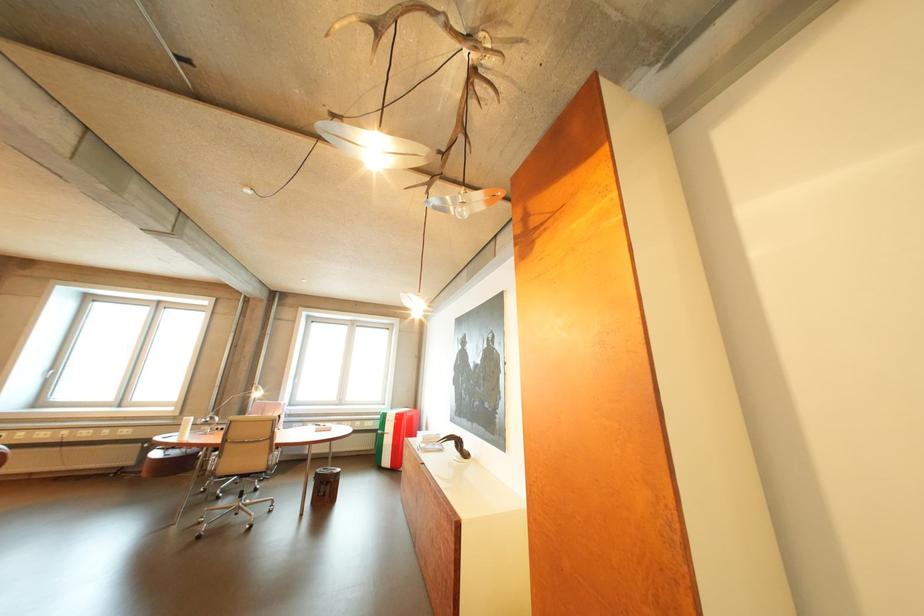
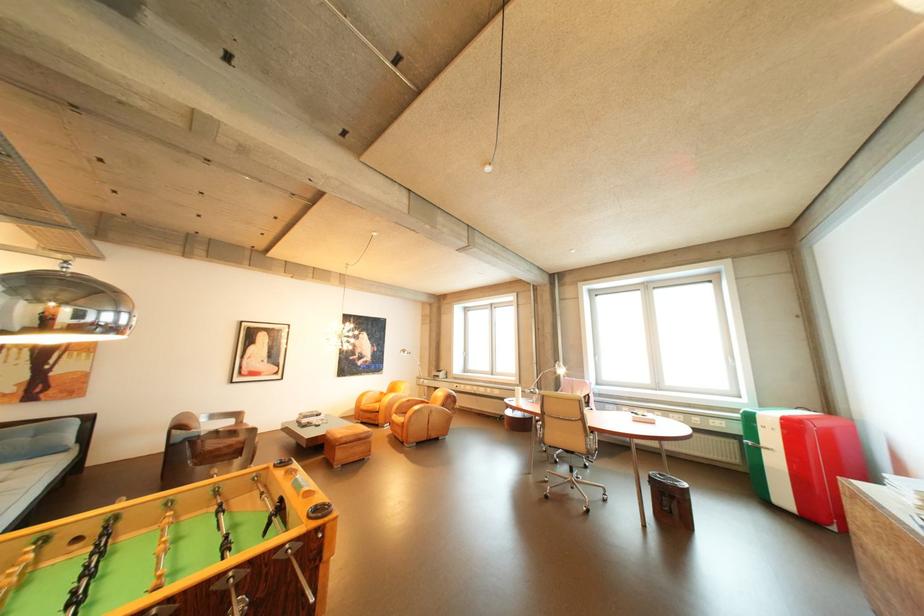
Locate, in the second image, the point that corresponds to (x=331, y=477) in the first image.

(666, 483)